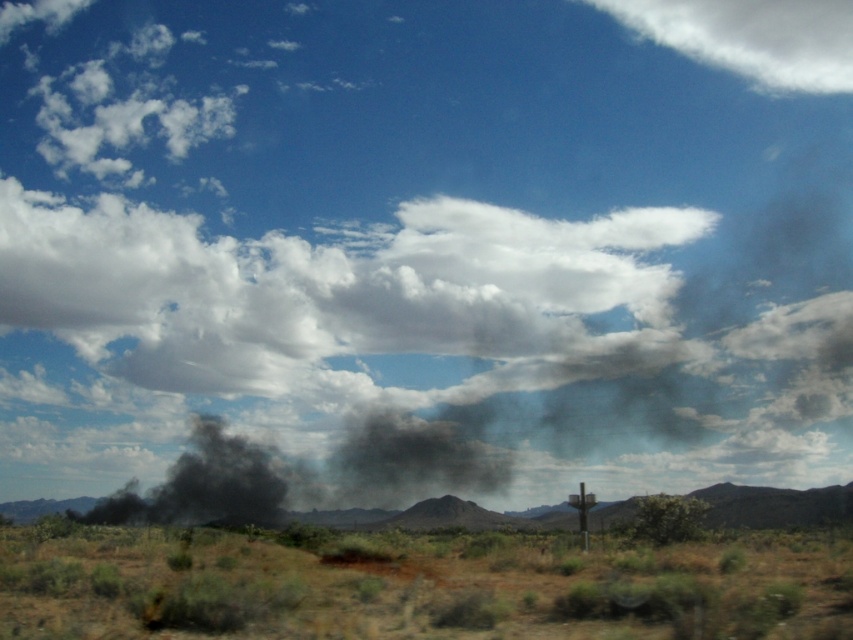
Which is in front, point (479, 534) or point (624, 12)?

Point (479, 534) is in front.

In the scene shown: Measure the distance between point (x=722, y=564) and camera.

Point (x=722, y=564) is 23.09 meters away from camera.

What do you see at coordinates (422, 586) in the screenshot?
I see `brown dry grass at lower left` at bounding box center [422, 586].

Identify the location of brown dry grass at lower left. The width and height of the screenshot is (853, 640). (422, 586).

Who is higher up, white fluffy cloud at upper center or black smoke at center?

white fluffy cloud at upper center is above.

Is white fluffy cloud at upper center shorter than black smoke at center?

Incorrect, white fluffy cloud at upper center's height does not fall short of black smoke at center's.

At what (x,y) coordinates should I click in order to perform the action: click on white fluffy cloud at upper center. Please return your answer as a coordinate pair (x, y). The width and height of the screenshot is (853, 640). Looking at the image, I should click on (752, 36).

Measure the distance from black matte smoke at center to black smoke at center.

A distance of 10.07 meters exists between black matte smoke at center and black smoke at center.

In the scene shown: Who is taller, black matte smoke at center or black smoke at center?

black matte smoke at center

Who is more forward, (x=476, y=515) or (x=262, y=518)?

Point (x=262, y=518) is in front.

Find the location of a particular element. The height and width of the screenshot is (640, 853). black matte smoke at center is located at coordinates (775, 506).